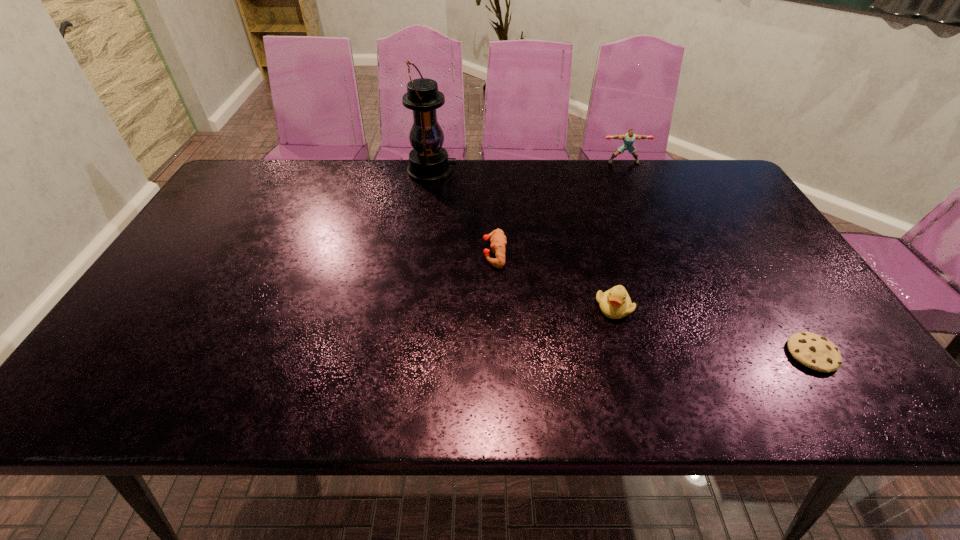
The height and width of the screenshot is (540, 960). Identify the location of object present at the right edge. (814, 351).

Where is `object present at the near right corner`? The height and width of the screenshot is (540, 960). object present at the near right corner is located at coordinates click(x=814, y=351).

Locate an element on the screen. vacant space at the far edge is located at coordinates (658, 193).

Where is `free region at the near edge of the desktop`? Image resolution: width=960 pixels, height=540 pixels. free region at the near edge of the desktop is located at coordinates (700, 376).

In the image, there is a desktop. What are the coordinates of `vacant space at the left edge` in the screenshot? It's located at (168, 352).

This screenshot has height=540, width=960. What are the coordinates of `vacant space at the right edge of the desktop` in the screenshot? It's located at (815, 327).

The width and height of the screenshot is (960, 540). Identify the location of blank space at the near left corner. (147, 373).

Locate an element on the screen. The image size is (960, 540). free spot at the far right corner of the desktop is located at coordinates (689, 193).

You are a GUI agent. You are given a task and a screenshot of the screen. Output one action in this format:
    pyautogui.click(x=<x>, y=<y>)
    Task: Click on the free space between the shortest object and the lantern
    The width and height of the screenshot is (960, 540).
    Given the screenshot: What is the action you would take?
    [x=622, y=263]

Locate an element on the screen. empty space that is in between the taller puncher and the nearest object is located at coordinates (718, 258).